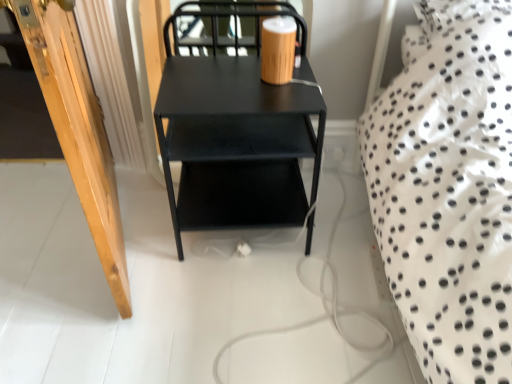
The height and width of the screenshot is (384, 512). Find the location of `free point to the right of wooden door at left`. free point to the right of wooden door at left is located at coordinates (225, 263).